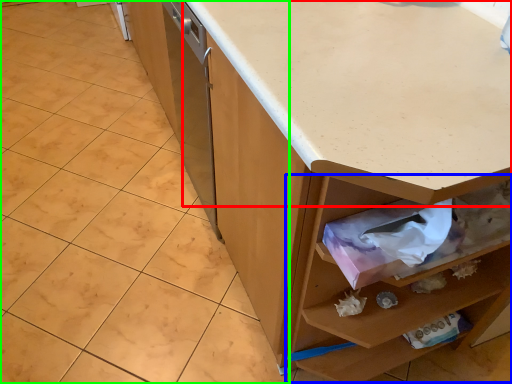
Question: Which object is the closest to the countertop (highlighted by a red box)? Choose among these: drawer (highlighted by a blue box) or granite (highlighted by a green box).

Choices:
 (A) drawer
 (B) granite

Answer: (A)